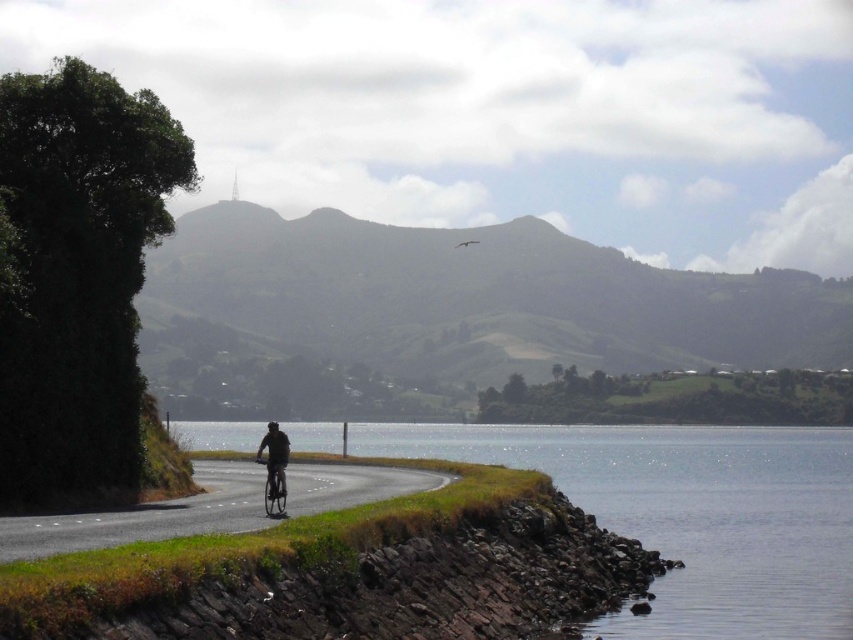
You are a hiker who wants to cross the road to reach the clear water at lower right. The metallic silver bicycle at center is blocking your path. Which direction should you walk around it to get to the water?

Since the clear water at lower right is to the right of the metallic silver bicycle at center, you should walk around the metallic silver bicycle at center to the right to reach the clear water at lower right.

You are standing at the point marked by the coordinates point (405, 433). You want to walk to the road that the cyclist is on. Is the road to your left or right?

The road is to your right because the cyclist is on the road, and the point (405, 433) is 217.56 meters away from you, indicating the road is in that direction.